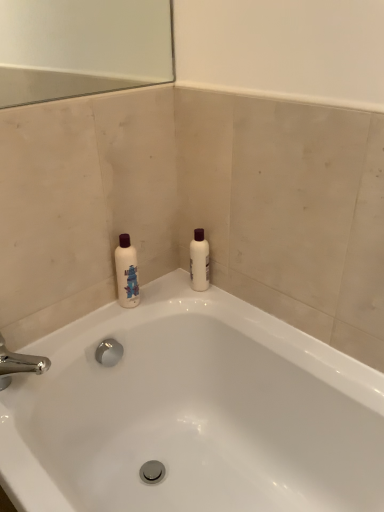
In order to click on white matte bottle at upper right in this screenshot , I will do `click(199, 261)`.

The image size is (384, 512). What do you see at coordinates (199, 261) in the screenshot?
I see `white matte bottle at upper right` at bounding box center [199, 261].

This screenshot has height=512, width=384. What do you see at coordinates (193, 413) in the screenshot?
I see `white glossy bathtub at upper center` at bounding box center [193, 413].

At what (x,y) coordinates should I click in order to perform the action: click on white glossy bathtub at upper center. Please return your answer as a coordinate pair (x, y). Image resolution: width=384 pixels, height=512 pixels. Looking at the image, I should click on (193, 413).

At what (x,y) coordinates should I click in order to perform the action: click on white matte bottle at upper right. Please return your answer as a coordinate pair (x, y). Looking at the image, I should click on (199, 261).

Can you confirm if white glossy bathtub at upper center is positioned to the left of white matte bottle at upper right?

Yes.

Which is in front, white glossy bathtub at upper center or white matte bottle at upper right?

white glossy bathtub at upper center is closer to the camera.

Does point (249, 356) lie behind point (199, 290)?

That is False.

From the image's perspective, is white glossy bathtub at upper center located above white matte bottle at upper right?

No.

From a real-world perspective, is white glossy bathtub at upper center physically located above or below white matte bottle at upper right?

In terms of real-world spatial position, white glossy bathtub at upper center is below white matte bottle at upper right.

Considering the relative sizes of white glossy bathtub at upper center and white matte bottle at upper right in the image provided, is white glossy bathtub at upper center thinner than white matte bottle at upper right?

No, white glossy bathtub at upper center is not thinner than white matte bottle at upper right.

Considering the relative sizes of white glossy bathtub at upper center and white matte bottle at upper right in the image provided, is white glossy bathtub at upper center shorter than white matte bottle at upper right?

In fact, white glossy bathtub at upper center may be taller than white matte bottle at upper right.

Who is bigger, white glossy bathtub at upper center or white matte bottle at upper right?

Bigger between the two is white glossy bathtub at upper center.

Is white glossy bathtub at upper center outside of white matte bottle at upper right?

That's correct, white glossy bathtub at upper center is outside of white matte bottle at upper right.

Is white glossy bathtub at upper center next to white matte bottle at upper right and touching it?

white glossy bathtub at upper center and white matte bottle at upper right are not in contact.

Is white glossy bathtub at upper center oriented away from white matte bottle at upper right?

No, white glossy bathtub at upper center's orientation is not away from white matte bottle at upper right.

Measure the distance between white glossy bathtub at upper center and white matte bottle at upper right.

14.79 inches.

At what (x,y) coordinates should I click in order to perform the action: click on cleaning product that is above the white glossy bathtub at upper center (from a real-world perspective). Please return your answer as a coordinate pair (x, y). Looking at the image, I should click on (199, 261).

Would you say white matte bottle at upper right is to the left or to the right of white glossy bathtub at upper center in the picture?

Clearly, white matte bottle at upper right is on the right of white glossy bathtub at upper center in the image.

From the picture: Considering their positions, is white matte bottle at upper right located in front of or behind white glossy bathtub at upper center?

Visually, white matte bottle at upper right is located behind white glossy bathtub at upper center.

Which point is more forward, (199, 259) or (136, 396)?

Point (199, 259)

From the image's perspective, which one is positioned lower, white matte bottle at upper right or white glossy bathtub at upper center?

From the image's view, white glossy bathtub at upper center is below.

From a real-world perspective, is white matte bottle at upper right positioned under white glossy bathtub at upper center based on gravity?

Incorrect, from a real-world perspective, white matte bottle at upper right is higher than white glossy bathtub at upper center.

Is white matte bottle at upper right wider or thinner than white glossy bathtub at upper center?

Considering their sizes, white matte bottle at upper right looks slimmer than white glossy bathtub at upper center.

Is white matte bottle at upper right taller or shorter than white glossy bathtub at upper center?

Considering their sizes, white matte bottle at upper right has less height than white glossy bathtub at upper center.

Is white matte bottle at upper right bigger or smaller than white glossy bathtub at upper center?

Considering their sizes, white matte bottle at upper right takes up less space than white glossy bathtub at upper center.

Is white matte bottle at upper right spatially inside white glossy bathtub at upper center, or outside of it?

white matte bottle at upper right cannot be found inside white glossy bathtub at upper center.

Is white matte bottle at upper right in contact with white glossy bathtub at upper center?

No, white matte bottle at upper right is not making contact with white glossy bathtub at upper center.

From the picture: Is white matte bottle at upper right looking in the opposite direction of white glossy bathtub at upper center?

No, white matte bottle at upper right's orientation is not away from white glossy bathtub at upper center.

Measure the distance from white matte bottle at upper right to white glossy bathtub at upper center.

A distance of 14.79 inches exists between white matte bottle at upper right and white glossy bathtub at upper center.

Where is `bathtub that is in front of the white matte bottle at upper right`? bathtub that is in front of the white matte bottle at upper right is located at coordinates (193, 413).

This screenshot has height=512, width=384. Identify the location of cleaning product above the white glossy bathtub at upper center (from a real-world perspective). (199, 261).

Locate an element on the screen. The width and height of the screenshot is (384, 512). cleaning product that is above the white glossy bathtub at upper center (from the image's perspective) is located at coordinates (199, 261).